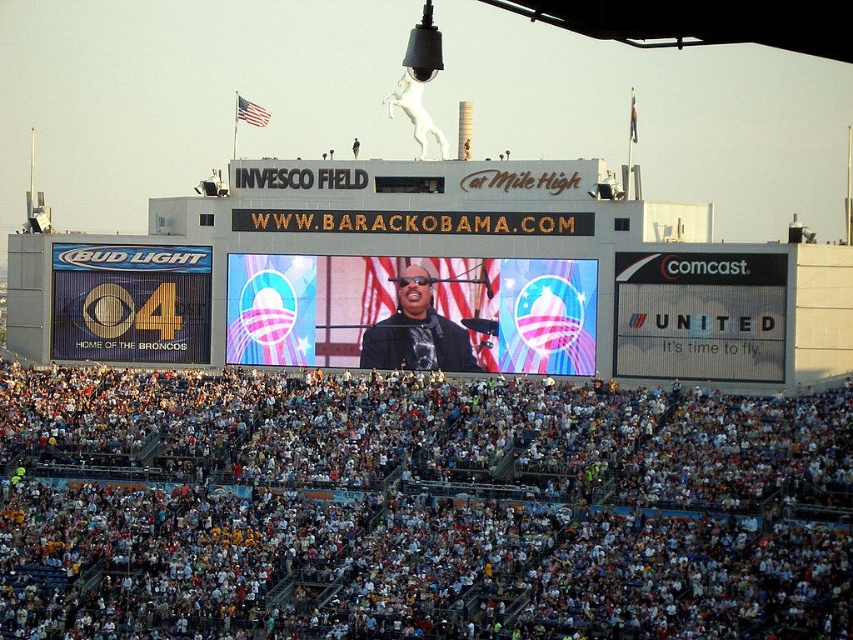
Question: Is white cotton crowd at lower center smaller than matte black jacket at center?

Choices:
 (A) no
 (B) yes

Answer: (A)

Question: Which point is closer to the camera taking this photo?

Choices:
 (A) (x=238, y=356)
 (B) (x=392, y=337)

Answer: (B)

Question: Can you confirm if shiny digital display at center is smaller than matte black jacket at center?

Choices:
 (A) no
 (B) yes

Answer: (A)

Question: Considering the real-world distances, which object is farthest from the white cotton crowd at lower center?

Choices:
 (A) matte black jacket at center
 (B) shiny digital display at center

Answer: (A)

Question: Is shiny digital display at center smaller than matte black jacket at center?

Choices:
 (A) no
 (B) yes

Answer: (A)

Question: Which point is closer to the camera?

Choices:
 (A) white cotton crowd at lower center
 (B) matte black jacket at center
 (C) shiny digital display at center

Answer: (A)